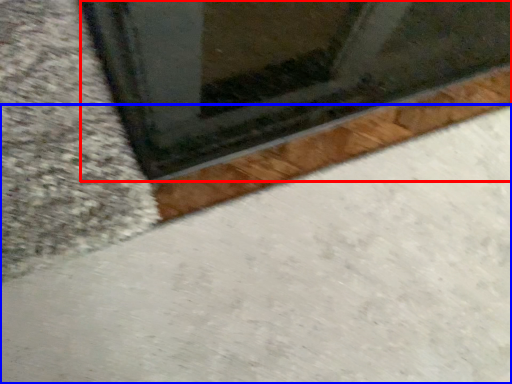
Question: Among these objects, which one is nearest to the camera, window (highlighted by a red box) or concrete (highlighted by a blue box)?

Choices:
 (A) window
 (B) concrete

Answer: (B)